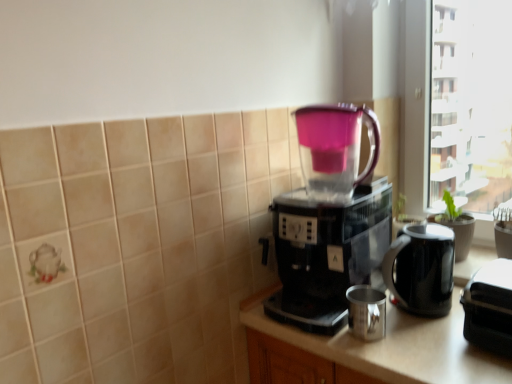
Find the location of a particular element. Image resolution: width=512 pixels, height=384 pixels. free location in front of black glossy electric kettle at right is located at coordinates (431, 351).